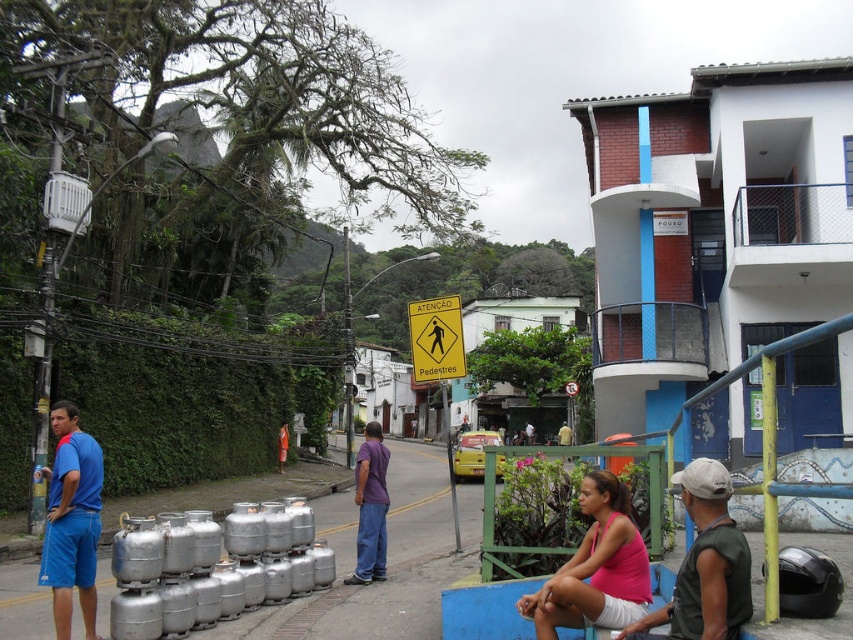
Question: Considering the relative positions of pink fabric tank top at lower center and green sleeveless shirt at lower right in the image provided, where is pink fabric tank top at lower center located with respect to green sleeveless shirt at lower right?

Choices:
 (A) right
 (B) left

Answer: (B)

Question: Which point appears closest to the camera in this image?

Choices:
 (A) (376, 474)
 (B) (583, 490)
 (C) (57, 422)

Answer: (B)

Question: Does green sleeveless shirt at lower right appear on the left side of blue fabric shirt at left?

Choices:
 (A) yes
 (B) no

Answer: (B)

Question: Is green sleeveless shirt at lower right above purple matte shirt at center?

Choices:
 (A) no
 (B) yes

Answer: (B)

Question: Which object is closer to the camera taking this photo?

Choices:
 (A) pink fabric tank top at lower center
 (B) blue fabric shirt at left

Answer: (A)

Question: Which object appears closest to the camera in this image?

Choices:
 (A) purple matte shirt at center
 (B) blue fabric shirt at left

Answer: (B)